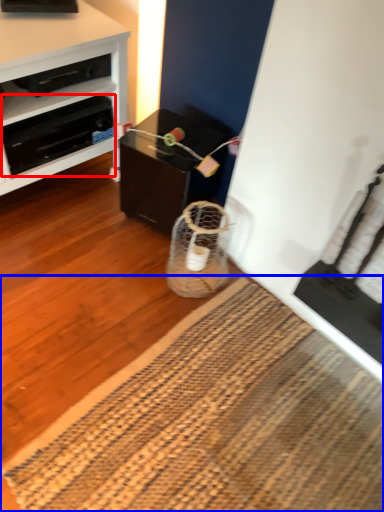
Question: Which object is further to the camera taking this photo, drawer (highlighted by a red box) or mat (highlighted by a blue box)?

Choices:
 (A) drawer
 (B) mat

Answer: (A)